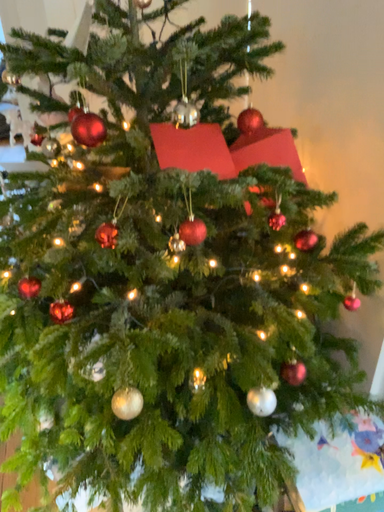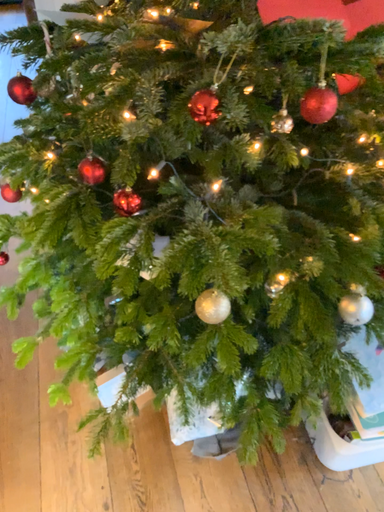
Question: Which way did the camera rotate in the video?

Choices:
 (A) rotated downward
 (B) rotated upward

Answer: (A)